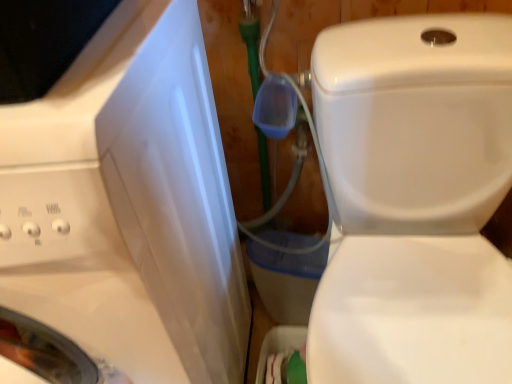
Question: Is white glossy washing machine at left shorter than white glossy toilet at center?

Choices:
 (A) yes
 (B) no

Answer: (B)

Question: From a real-world perspective, is white glossy washing machine at left below white glossy toilet at center?

Choices:
 (A) no
 (B) yes

Answer: (A)

Question: Is white glossy toilet at center at the back of white glossy washing machine at left?

Choices:
 (A) no
 (B) yes

Answer: (A)

Question: Can you confirm if white glossy washing machine at left is bigger than white glossy toilet at center?

Choices:
 (A) no
 (B) yes

Answer: (B)

Question: Does white glossy washing machine at left have a smaller size compared to white glossy toilet at center?

Choices:
 (A) no
 (B) yes

Answer: (A)

Question: Is white glossy washing machine at left not close to white glossy toilet at center?

Choices:
 (A) no
 (B) yes

Answer: (A)

Question: From a real-world perspective, is white glossy toilet at center under white glossy washing machine at left?

Choices:
 (A) no
 (B) yes

Answer: (B)

Question: Could you tell me if white glossy toilet at center is facing white glossy washing machine at left?

Choices:
 (A) yes
 (B) no

Answer: (B)

Question: Is white glossy toilet at center thinner than white glossy washing machine at left?

Choices:
 (A) no
 (B) yes

Answer: (A)

Question: From the image's perspective, is white glossy toilet at center beneath white glossy washing machine at left?

Choices:
 (A) no
 (B) yes

Answer: (B)

Question: Is white glossy washing machine at left surrounded by white glossy toilet at center?

Choices:
 (A) no
 (B) yes

Answer: (A)

Question: Considering the relative sizes of white glossy toilet at center and white glossy washing machine at left in the image provided, is white glossy toilet at center shorter than white glossy washing machine at left?

Choices:
 (A) no
 (B) yes

Answer: (B)

Question: From a real-world perspective, is white glossy toilet at center above or below white glossy washing machine at left?

Choices:
 (A) below
 (B) above

Answer: (A)